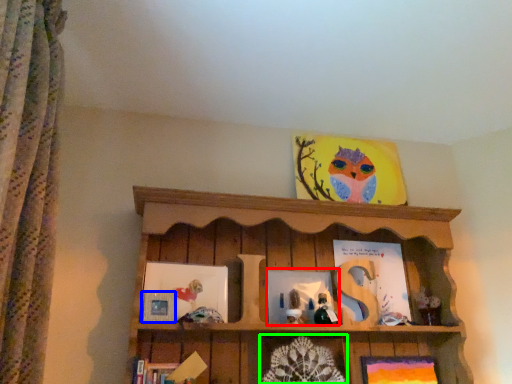
Question: Considering the real-world distances, which object is farthest from picture frame (highlighted by a red box)? picture frame (highlighted by a blue box) or picture frame (highlighted by a green box)?

Choices:
 (A) picture frame
 (B) picture frame

Answer: (A)